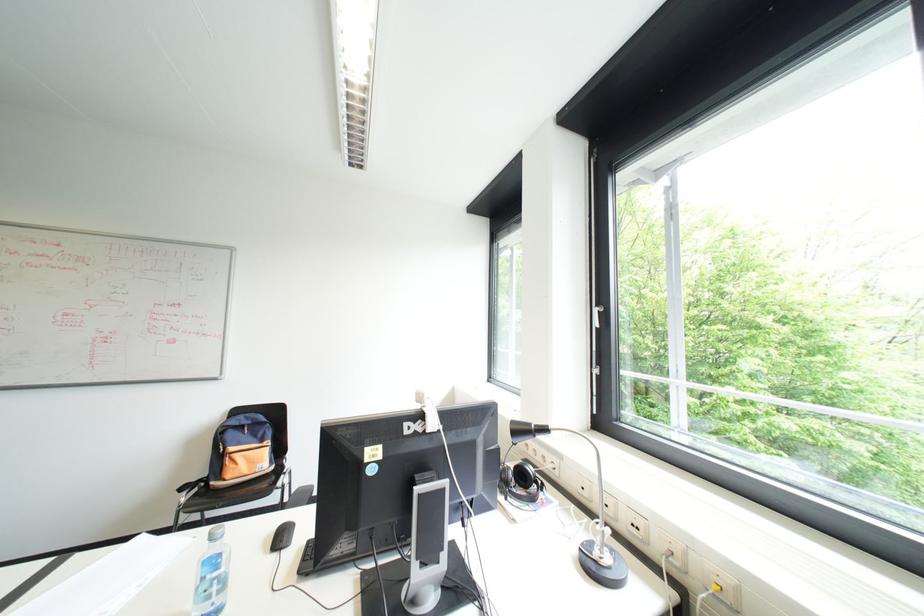
I want to click on white window handle, so click(596, 315).